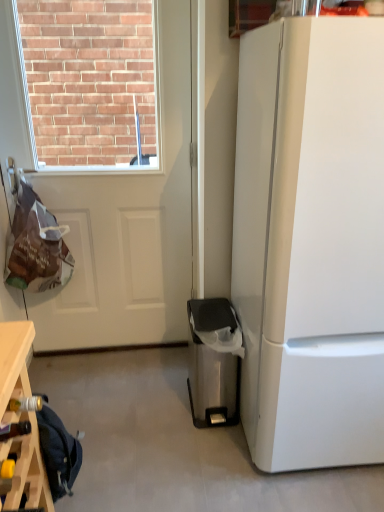
Question: In terms of width, does wooden wine rack at lower left look wider or thinner when compared to white glossy refrigerator at right?

Choices:
 (A) wide
 (B) thin

Answer: (B)

Question: Does point (11, 345) appear closer or farther from the camera than point (339, 344)?

Choices:
 (A) closer
 (B) farther

Answer: (A)

Question: Estimate the real-world distances between objects in this image. Which object is closer to the white glossy refrigerator at right?

Choices:
 (A) wooden wine rack at lower left
 (B) white matte door at upper left
 (C) stainless steel trash can at lower right

Answer: (C)

Question: Estimate the real-world distances between objects in this image. Which object is closer to the stainless steel trash can at lower right?

Choices:
 (A) white glossy refrigerator at right
 (B) white matte door at upper left
 (C) wooden wine rack at lower left

Answer: (A)